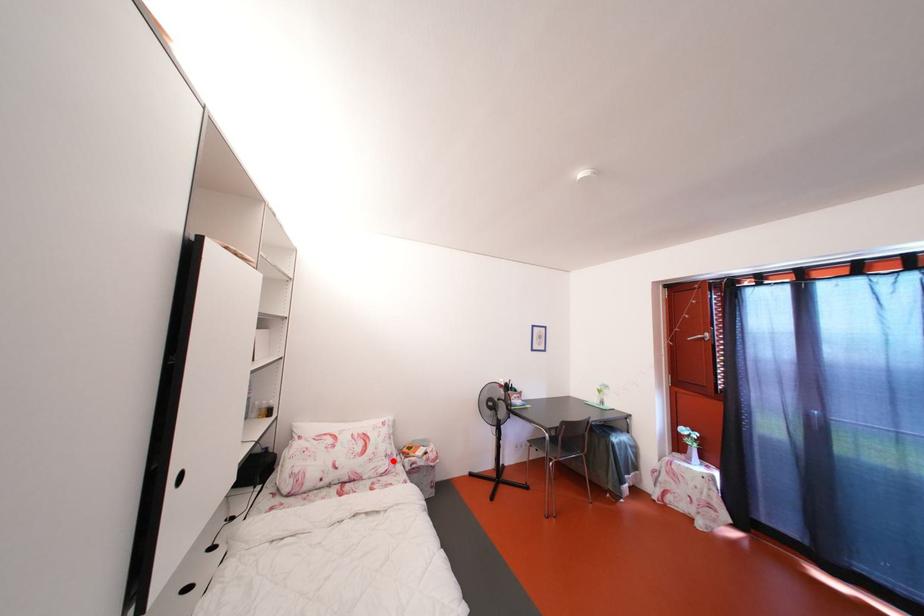
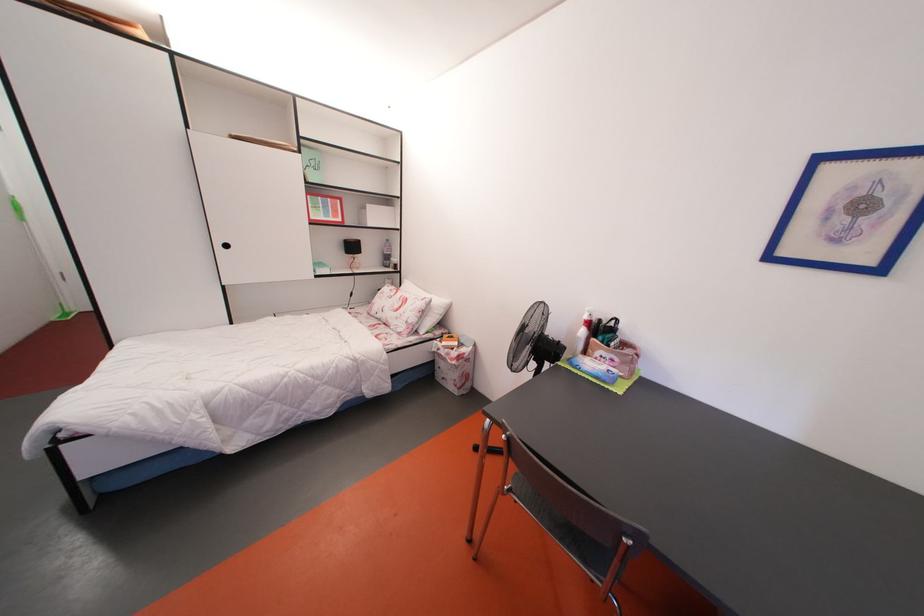
Question: I am providing you with two images of the same scene from different viewpoints. In image1, a red point is highlighted. Considering the same 3D point in image2, which of the following is correct?

Choices:
 (A) It is closer
 (B) It is farther

Answer: (B)